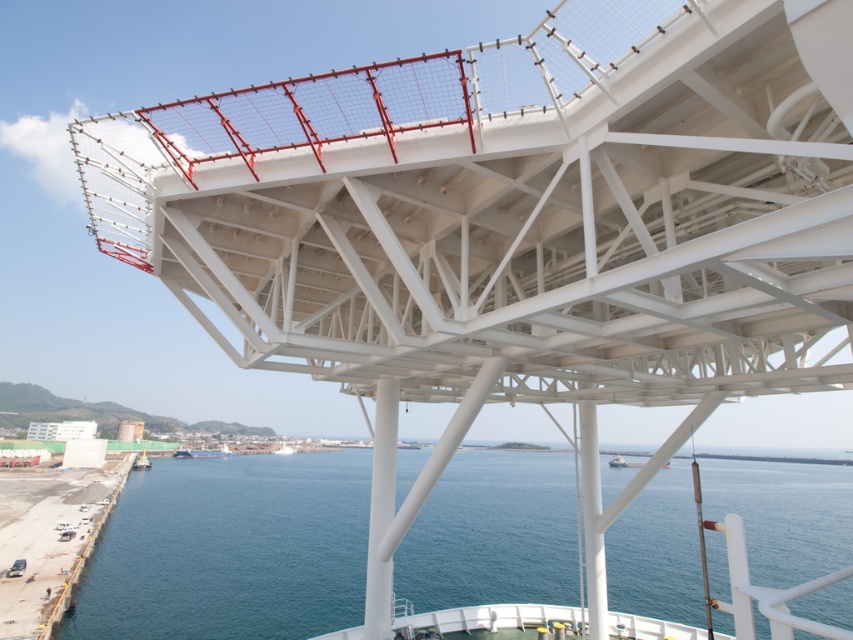
Question: Does blue water at center come in front of concrete dock at lower left?

Choices:
 (A) yes
 (B) no

Answer: (A)

Question: Which object is the farthest from the dark blue metal boat at lower left?

Choices:
 (A) yellow matte boat at lower left
 (B) concrete dock at lower left

Answer: (B)

Question: Among these objects, which one is nearest to the camera?

Choices:
 (A) blue water at center
 (B) white matte boat at center
 (C) dark blue metal boat at lower left
 (D) yellow matte boat at lower left

Answer: (A)

Question: Which object appears farthest from the camera in this image?

Choices:
 (A) white matte boat at center
 (B) concrete dock at lower left
 (C) blue water at center
 (D) dark blue metal boat at lower left

Answer: (D)

Question: From the image, what is the correct spatial relationship of concrete dock at lower left in relation to white matte boat at center?

Choices:
 (A) below
 (B) above

Answer: (B)

Question: In this image, where is blue water at center located relative to concrete dock at lower left?

Choices:
 (A) below
 (B) above

Answer: (A)